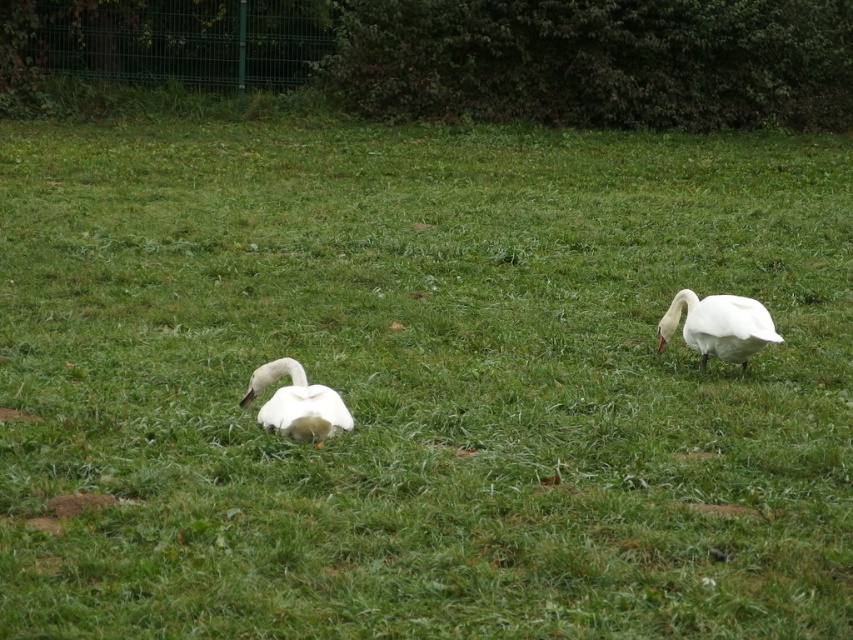
You are standing at the point marked by the coordinate point at (712, 300). You want to walk towards the swans. Are you closer to the first swan or the second swan?

Since you are at the point marked by the coordinate point at (712, 300), and the swans are 6.30 meters apart, you are equidistant to both swans.

You are standing in the grassy area and want to place a small food bowl for the swans. If you place it exactly halfway between the white matte swan at right and the green fence in the background, will it be closer to the swan or the fence?

The white matte swan at right is located at point (718,326). Since the fence is at the top of the image, the halfway point would still be closer to the swan than the fence.